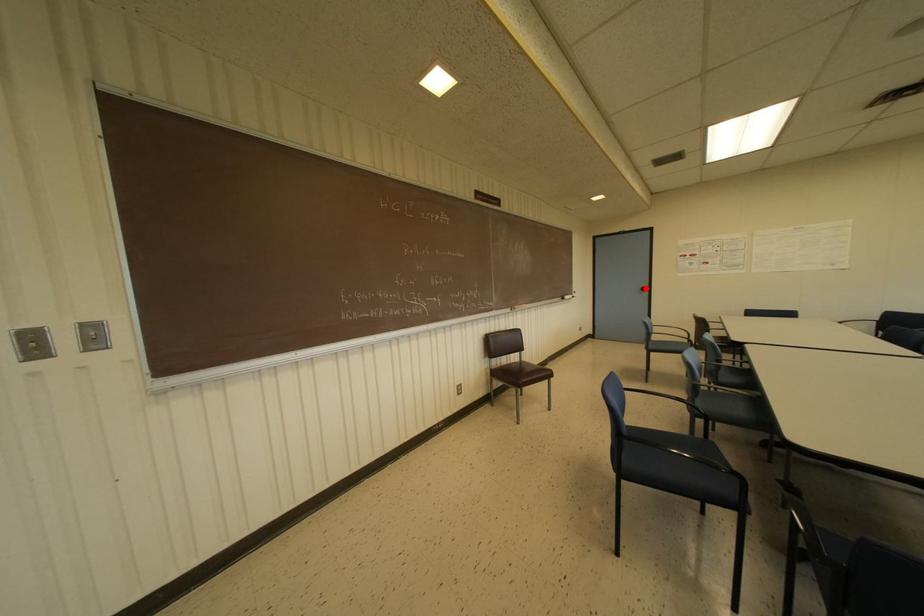
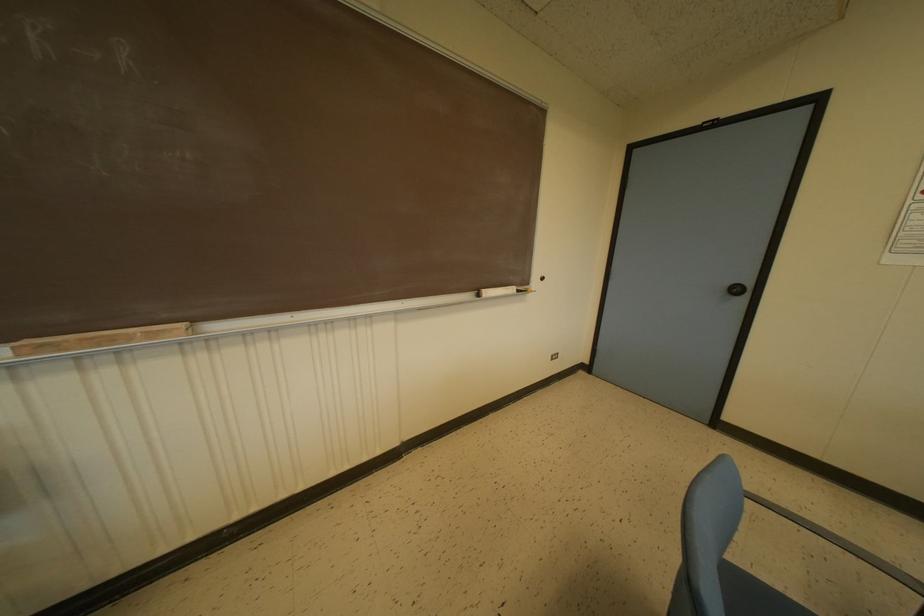
Question: I am providing you with two images of the same scene from different viewpoints. A red point is marked on the first image. Can you still see the location of the red point in image 2?

Choices:
 (A) Yes
 (B) No

Answer: (A)